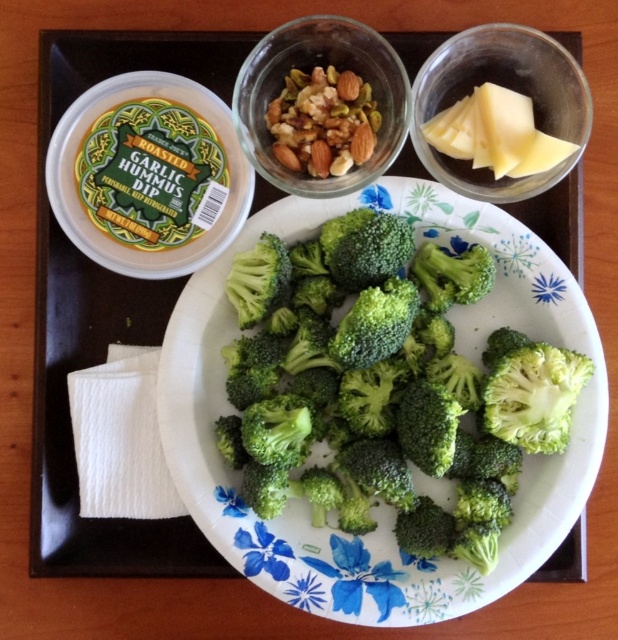
Is green fresh broccoli at center smaller than shiny glass bowl at upper center?

No, green fresh broccoli at center is not smaller than shiny glass bowl at upper center.

Which is above, green fresh broccoli at center or shiny glass bowl at upper center?

shiny glass bowl at upper center is above.

The height and width of the screenshot is (640, 618). Identify the location of green fresh broccoli at center. (384, 381).

Identify the location of green fresh broccoli at center. Image resolution: width=618 pixels, height=640 pixels. (384, 381).

Can you confirm if green fresh broccoli at center is bigger than yellowish hard cheese at upper right?

Yes.

The height and width of the screenshot is (640, 618). What are the coordinates of `green fresh broccoli at center` in the screenshot? It's located at (384, 381).

This screenshot has height=640, width=618. I want to click on green fresh broccoli at center, so click(384, 381).

Who is lower down, shiny glass bowl at upper center or yellowish hard cheese at upper right?

yellowish hard cheese at upper right

Who is taller, shiny glass bowl at upper center or yellowish hard cheese at upper right?

shiny glass bowl at upper center is taller.

Is point (253, 102) positioned after point (574, 145)?

Yes.

At what (x,y) coordinates should I click in order to perform the action: click on shiny glass bowl at upper center. Please return your answer as a coordinate pair (x, y). The image size is (618, 640). Looking at the image, I should click on (307, 67).